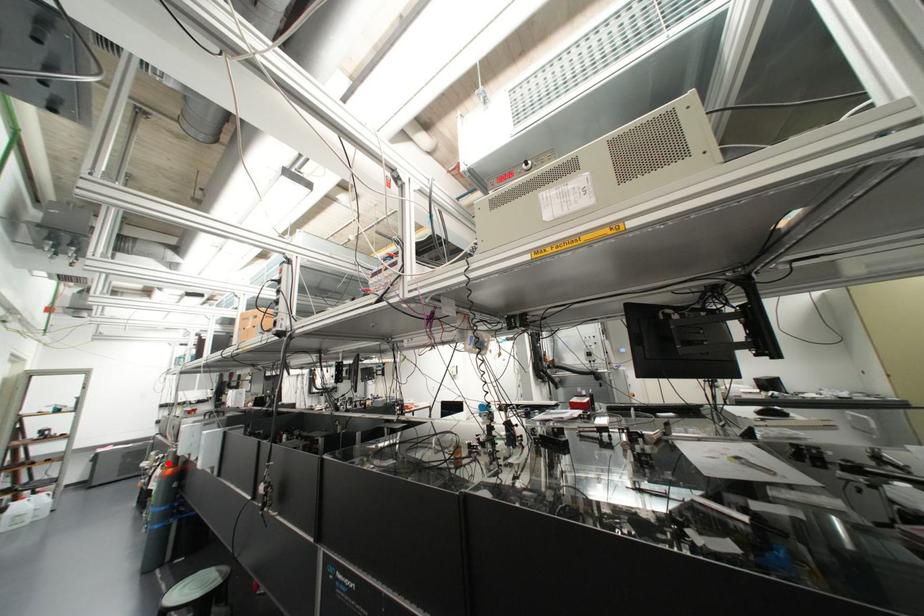
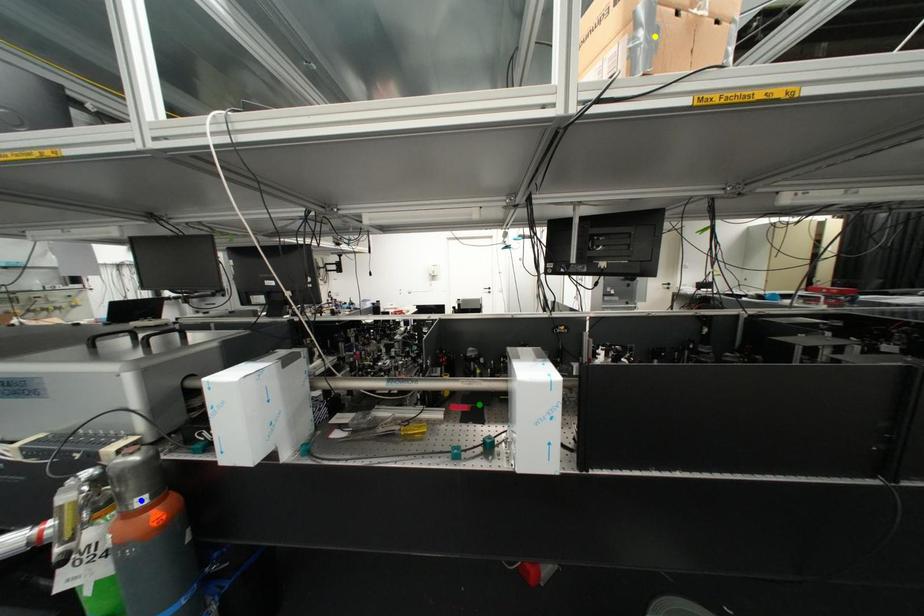
Question: I am providing you with two images of the same scene from different viewpoints. A red point is marked on the first image. You are given multiple points on the second image. In image 2, which mark is for the same physical point as the one in image 1?

Choices:
 (A) yellow point
 (B) blue point
 (C) green point

Answer: (B)